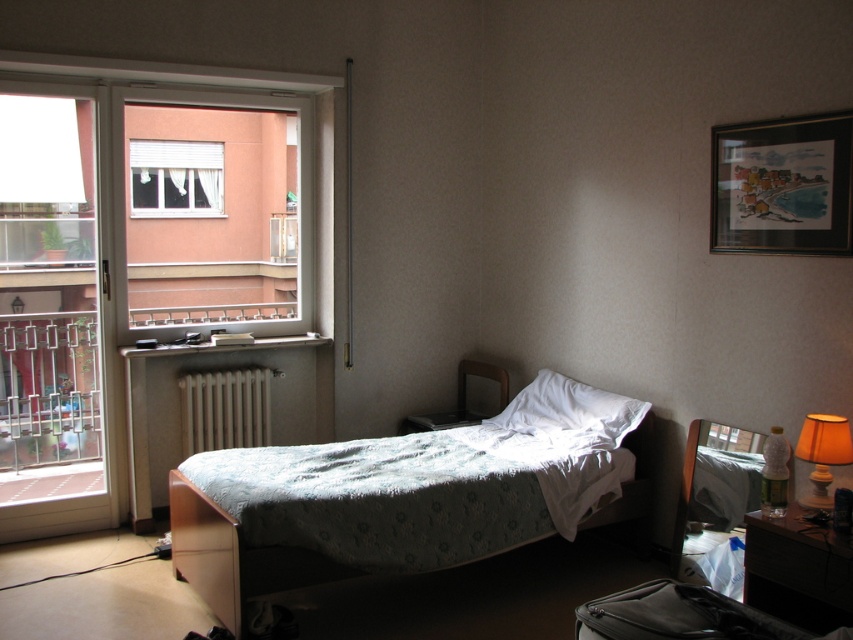
Question: Which of the following is the closest to the observer?

Choices:
 (A) (x=544, y=429)
 (B) (x=67, y=440)

Answer: (A)

Question: Which point is closer to the camera?

Choices:
 (A) (624, 412)
 (B) (206, 161)
 (C) (283, 451)
 (D) (842, 429)

Answer: (D)

Question: Is wooden picture frame at upper right wider than orange fabric lampshade at right?

Choices:
 (A) no
 (B) yes

Answer: (B)

Question: Can you confirm if wooden picture frame at upper right is wider than white fabric window at upper left?

Choices:
 (A) yes
 (B) no

Answer: (B)

Question: Estimate the real-world distances between objects in this image. Which object is closer to the orange fabric lampshade at right?

Choices:
 (A) white wooden radiator at center
 (B) matte wooden dresser at lower right
 (C) white soft pillow at center

Answer: (B)

Question: Can you confirm if white plastic screen door at left is positioned below matte wooden dresser at lower right?

Choices:
 (A) yes
 (B) no

Answer: (B)